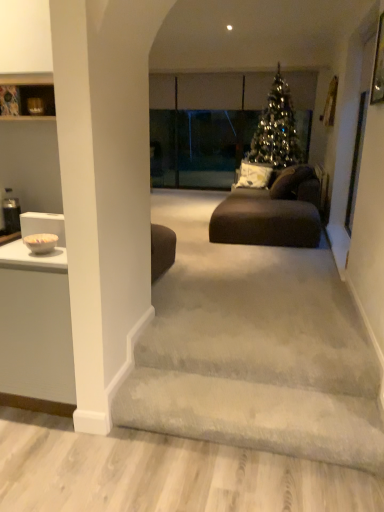
Locate an element on the screen. This screenshot has height=512, width=384. gray plush carpet at lower center is located at coordinates (254, 416).

Measure the distance between gray plush carpet at lower center and camera.

gray plush carpet at lower center and camera are 1.85 meters apart from each other.

This screenshot has height=512, width=384. What do you see at coordinates (254, 416) in the screenshot?
I see `gray plush carpet at lower center` at bounding box center [254, 416].

The image size is (384, 512). What are the coordinates of `gray plush carpet at lower center` in the screenshot? It's located at (254, 416).